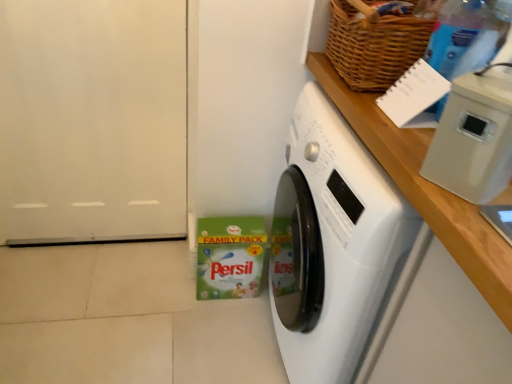
Describe the element at coordinates (93, 121) in the screenshot. I see `white matte door at left` at that location.

Image resolution: width=512 pixels, height=384 pixels. What do you see at coordinates (467, 35) in the screenshot? I see `transparent plastic bottle at upper right` at bounding box center [467, 35].

What is the approximate height of transparent plastic bottle at upper right?

transparent plastic bottle at upper right is 10.82 inches tall.

Identify the location of white plastic container at upper right. The width and height of the screenshot is (512, 384). (473, 139).

From a real-world perspective, is white glossy washing machine at center positioned under white plastic container at upper right based on gravity?

Yes, from a real-world perspective, white glossy washing machine at center is under white plastic container at upper right.

Does white glossy washing machine at center lie behind white plastic container at upper right?

Yes, it is behind white plastic container at upper right.

Is white glossy washing machine at center to the right of white plastic container at upper right from the viewer's perspective?

Correct, you'll find white glossy washing machine at center to the right of white plastic container at upper right.

Could you tell me if woven brown basket at upper right is facing white matte door at left?

No, woven brown basket at upper right is not turned towards white matte door at left.

Is woven brown basket at upper right positioned beyond the bounds of white matte door at left?

That's correct, woven brown basket at upper right is outside of white matte door at left.

Looking at this image, from a real-world perspective, who is located higher, woven brown basket at upper right or white matte door at left?

In real-world perspective, woven brown basket at upper right is above.

Does point (409, 31) appear closer or farther from the camera than point (69, 69)?

Point (409, 31) is positioned closer to the camera compared to point (69, 69).

Considering the relative sizes of white plastic container at upper right and white glossy washing machine at center in the image provided, is white plastic container at upper right smaller than white glossy washing machine at center?

Correct, white plastic container at upper right occupies less space than white glossy washing machine at center.

From a real-world perspective, which object rests below the other?

white glossy washing machine at center.

Is white plastic container at upper right touching white glossy washing machine at center?

white plastic container at upper right is not next to white glossy washing machine at center, and they're not touching.

Identify the location of appliance lying in front of the white glossy washing machine at center. The image size is (512, 384). (473, 139).

From the image's perspective, is white plastic container at upper right on transparent plastic bottle at upper right?

No.

Considering the sizes of objects white plastic container at upper right and transparent plastic bottle at upper right in the image provided, who is shorter, white plastic container at upper right or transparent plastic bottle at upper right?

Standing shorter between the two is white plastic container at upper right.

Looking at this image, which object is wider, white plastic container at upper right or transparent plastic bottle at upper right?

With larger width is white plastic container at upper right.

Which of these two, white plastic container at upper right or transparent plastic bottle at upper right, is bigger?

With larger size is transparent plastic bottle at upper right.

Considering the sizes of white matte door at left and white plastic container at upper right in the image, is white matte door at left taller or shorter than white plastic container at upper right?

In the image, white matte door at left appears to be taller than white plastic container at upper right.

Is white matte door at left directly adjacent to white plastic container at upper right?

No, white matte door at left is not beside white plastic container at upper right.

Is white matte door at left further to the viewer compared to white plastic container at upper right?

Yes, white matte door at left is further from the camera.

Could you tell me if white matte door at left is facing white plastic container at upper right?

No, white matte door at left is not aimed at white plastic container at upper right.

Is woven brown basket at upper right aimed at white glossy washing machine at center?

No, woven brown basket at upper right does not turn towards white glossy washing machine at center.

Considering the relative sizes of woven brown basket at upper right and white glossy washing machine at center in the image provided, is woven brown basket at upper right shorter than white glossy washing machine at center?

Yes.

Choose the correct answer: Is woven brown basket at upper right inside white glossy washing machine at center or outside it?

woven brown basket at upper right lies outside white glossy washing machine at center.

What's the angular difference between woven brown basket at upper right and white glossy washing machine at center's facing directions?

4.65 degrees separate the facing orientations of woven brown basket at upper right and white glossy washing machine at center.

In the scene shown: Can you confirm if white matte door at left is positioned to the left of transparent plastic bottle at upper right?

Yes, white matte door at left is to the left of transparent plastic bottle at upper right.

Could transparent plastic bottle at upper right be considered to be inside white matte door at left?

No, white matte door at left does not contain transparent plastic bottle at upper right.

Is white matte door at left oriented towards transparent plastic bottle at upper right?

No, white matte door at left is not oriented towards transparent plastic bottle at upper right.

Between white matte door at left and transparent plastic bottle at upper right, which one has less height?

Standing shorter between the two is transparent plastic bottle at upper right.

This screenshot has width=512, height=384. Identify the location of appliance in front of the white glossy washing machine at center. (473, 139).

You are a GUI agent. You are given a task and a screenshot of the screen. Output one action in this format:
    pyautogui.click(x=<x>, y=<y>)
    Task: Click on the door that appears on the left of woven brown basket at upper right
    Image resolution: width=512 pixels, height=384 pixels.
    Given the screenshot: What is the action you would take?
    pyautogui.click(x=93, y=121)

Which object lies further to the anchor point woven brown basket at upper right, transparent plastic bottle at upper right or white glossy washing machine at center?

Among the two, white glossy washing machine at center is located further to woven brown basket at upper right.

Based on their spatial positions, is transparent plastic bottle at upper right or white matte door at left further from woven brown basket at upper right?

white matte door at left.

From the image, which object appears to be nearer to white matte door at left, white glossy washing machine at center or white plastic container at upper right?

The object closer to white matte door at left is white glossy washing machine at center.

Based on their spatial positions, is white glossy washing machine at center or white matte door at left further from transparent plastic bottle at upper right?

white matte door at left lies further to transparent plastic bottle at upper right than the other object.

Looking at the image, which one is located closer to white glossy washing machine at center, white plastic container at upper right or white matte door at left?

white plastic container at upper right is closer to white glossy washing machine at center.

Which object lies nearer to the anchor point transparent plastic bottle at upper right, woven brown basket at upper right or white glossy washing machine at center?

woven brown basket at upper right is closer to transparent plastic bottle at upper right.

Estimate the real-world distances between objects in this image. Which object is closer to woven brown basket at upper right, white matte door at left or white plastic container at upper right?

Among the two, white plastic container at upper right is located nearer to woven brown basket at upper right.

Looking at the image, which one is located further to white plastic container at upper right, white matte door at left or woven brown basket at upper right?

Among the two, white matte door at left is located further to white plastic container at upper right.

Find the location of `basket between white matte door at left and transparent plastic bottle at upper right from left to right`. basket between white matte door at left and transparent plastic bottle at upper right from left to right is located at coordinates (374, 46).

Find the location of a particular element. appliance between transparent plastic bottle at upper right and white glossy washing machine at center in the up-down direction is located at coordinates (473, 139).

Locate an element on the screen. washing machine between white matte door at left and woven brown basket at upper right in the horizontal direction is located at coordinates (369, 271).

The width and height of the screenshot is (512, 384). What are the coordinates of `appliance located between white matte door at left and transparent plastic bottle at upper right in the left-right direction` in the screenshot? It's located at (473, 139).